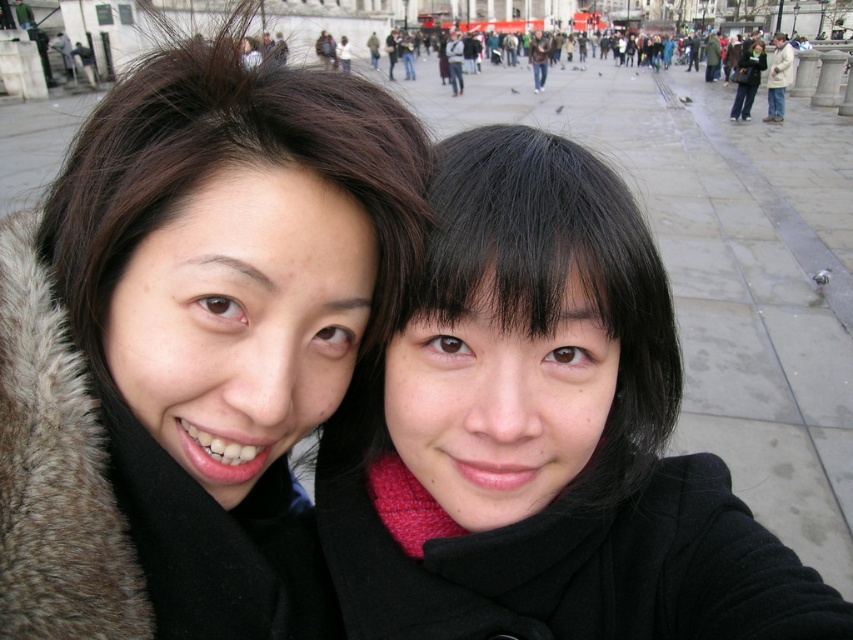
Between black fur coat at upper left and black matte coat at center, which one appears on the right side from the viewer's perspective?

Positioned to the right is black matte coat at center.

Does black fur coat at upper left have a greater width compared to black matte coat at center?

In fact, black fur coat at upper left might be narrower than black matte coat at center.

Who is more forward, (209, 333) or (477, 490)?

Point (209, 333) is in front.

This screenshot has height=640, width=853. I want to click on black fur coat at upper left, so point(193,344).